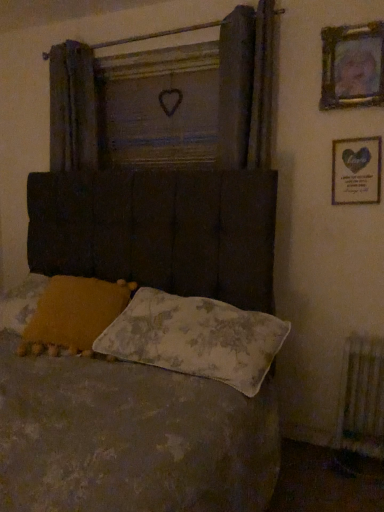
What is the approximate height of floral fabric pillow at center, the first pillow from the right?

11.17 inches.

Measure the distance between point (334, 186) and camera.

Point (334, 186) and camera are 2.04 meters apart from each other.

You are a GUI agent. You are given a task and a screenshot of the screen. Output one action in this format:
    pyautogui.click(x=<x>, y=<y>)
    Task: Click on the metallic silver frame at upper right, positioned as the 2th picture frame in top-to-bottom order
    
    Given the screenshot: What is the action you would take?
    pyautogui.click(x=356, y=170)

Identify the location of gold-framed picture at upper right, the second picture frame in the bottom-to-top sequence. The width and height of the screenshot is (384, 512). (352, 66).

The image size is (384, 512). What do you see at coordinates (74, 314) in the screenshot?
I see `fluffy yellow pillow at lower left, positioned as the 2th pillow in right-to-left order` at bounding box center [74, 314].

Measure the distance between point (101, 319) and camera.

A distance of 6.17 feet exists between point (101, 319) and camera.

What do you see at coordinates (73, 108) in the screenshot?
I see `dark gray fabric curtain at upper left` at bounding box center [73, 108].

The width and height of the screenshot is (384, 512). Identify the location of floral fabric pillow at center, the first pillow from the right. (195, 338).

I want to click on picture frame that is above the metallic silver frame at upper right, the 1th picture frame from the bottom (from the image's perspective), so click(352, 66).

From a real-world perspective, is metallic silver frame at upper right, positioned as the 2th picture frame in top-to-bottom order, located beneath gold-framed picture at upper right, the first picture frame positioned from the top?

Yes.

In the scene shown: Is metallic silver frame at upper right, the 1th picture frame from the bottom, wider or thinner than gold-framed picture at upper right, the second picture frame in the bottom-to-top sequence?

metallic silver frame at upper right, the 1th picture frame from the bottom, is thinner than gold-framed picture at upper right, the second picture frame in the bottom-to-top sequence.

Which object is closer to the camera, metallic silver frame at upper right, the 1th picture frame from the bottom, or gold-framed picture at upper right, the first picture frame positioned from the top?

gold-framed picture at upper right, the first picture frame positioned from the top, is more forward.

Which of these two, textured fabric bed at center or wooden heart at center, is bigger?

textured fabric bed at center.

Can we say textured fabric bed at center lies outside wooden heart at center?

Absolutely, textured fabric bed at center is external to wooden heart at center.

Are textured fabric bed at center and wooden heart at center making contact?

textured fabric bed at center is not next to wooden heart at center, and they're not touching.

From a real-world perspective, is textured fabric bed at center above or below gold-framed picture at upper right, the second picture frame in the bottom-to-top sequence?

From a real-world perspective, textured fabric bed at center is physically below gold-framed picture at upper right, the second picture frame in the bottom-to-top sequence.

Between textured fabric bed at center and gold-framed picture at upper right, the second picture frame in the bottom-to-top sequence, which one has more height?

With more height is textured fabric bed at center.

Between textured fabric bed at center and gold-framed picture at upper right, the first picture frame positioned from the top, which one has larger size?

Bigger between the two is textured fabric bed at center.

Is gold-framed picture at upper right, the first picture frame positioned from the top, inside textured fabric bed at center?

Actually, gold-framed picture at upper right, the first picture frame positioned from the top, is outside textured fabric bed at center.

Could metallic silver frame at upper right, the 1th picture frame from the bottom, be considered to be inside dark gray fabric curtain at upper left?

That's incorrect, metallic silver frame at upper right, the 1th picture frame from the bottom, is not inside dark gray fabric curtain at upper left.

Which object is wider, dark gray fabric curtain at upper left or metallic silver frame at upper right, the 1th picture frame from the bottom?

With larger width is dark gray fabric curtain at upper left.

Is dark gray fabric curtain at upper left bigger than metallic silver frame at upper right, positioned as the 2th picture frame in top-to-bottom order?

Yes.

From a real-world perspective, is fluffy yellow pillow at lower left, placed as the 1th pillow when sorted from left to right, over wooden heart at center?

Actually, fluffy yellow pillow at lower left, placed as the 1th pillow when sorted from left to right, is physically below wooden heart at center in the real world.

What's the angular difference between fluffy yellow pillow at lower left, placed as the 1th pillow when sorted from left to right, and wooden heart at center's facing directions?

16.5 degrees.

From the image's perspective, who appears lower, fluffy yellow pillow at lower left, placed as the 1th pillow when sorted from left to right, or wooden heart at center?

From the image's view, fluffy yellow pillow at lower left, placed as the 1th pillow when sorted from left to right, is below.

Is floral fabric pillow at center, the first pillow from the right, bigger than gold-framed picture at upper right, the first picture frame positioned from the top?

Indeed, floral fabric pillow at center, the first pillow from the right, has a larger size compared to gold-framed picture at upper right, the first picture frame positioned from the top.

Between floral fabric pillow at center, positioned as the 2th pillow in left-to-right order, and gold-framed picture at upper right, the second picture frame in the bottom-to-top sequence, which one has larger width?

floral fabric pillow at center, positioned as the 2th pillow in left-to-right order, is wider.

From the image's perspective, starting from the gold-framed picture at upper right, the first picture frame positioned from the top, which pillow is the 2nd one below? Please provide its 2D coordinates.

[(195, 338)]

Is floral fabric pillow at center, positioned as the 2th pillow in left-to-right order, positioned far away from gold-framed picture at upper right, the second picture frame in the bottom-to-top sequence?

floral fabric pillow at center, positioned as the 2th pillow in left-to-right order, is positioned a significant distance from gold-framed picture at upper right, the second picture frame in the bottom-to-top sequence.

Between point (367, 375) and point (147, 145), which one is positioned behind?

The point (147, 145) is farther from the camera.

Is white textured radiator at lower right looking in the opposite direction of wooden heart at center?

white textured radiator at lower right is not turned away from wooden heart at center.

Would you say white textured radiator at lower right is inside or outside wooden heart at center?

white textured radiator at lower right is not inside wooden heart at center, it's outside.

From a real-world perspective, is white textured radiator at lower right above or below wooden heart at center?

Clearly, from a real-world perspective, white textured radiator at lower right is below wooden heart at center.

Image resolution: width=384 pixels, height=512 pixels. In order to click on picture frame positioned vertically above the metallic silver frame at upper right, positioned as the 2th picture frame in top-to-bottom order (from a real-world perspective) in this screenshot , I will do `click(352, 66)`.

What are the coordinates of `window screen behind the textured fabric bed at center` in the screenshot? It's located at (159, 106).

Looking at the image, which one is located further to gold-framed picture at upper right, the first picture frame positioned from the top, textured fabric bed at center or fluffy yellow pillow at lower left, placed as the 1th pillow when sorted from left to right?

Based on the image, fluffy yellow pillow at lower left, placed as the 1th pillow when sorted from left to right, appears to be further to gold-framed picture at upper right, the first picture frame positioned from the top.

Looking at the image, which one is located closer to textured fabric bed at center, gold-framed picture at upper right, the first picture frame positioned from the top, or fluffy yellow pillow at lower left, positioned as the 2th pillow in right-to-left order?

The object closer to textured fabric bed at center is fluffy yellow pillow at lower left, positioned as the 2th pillow in right-to-left order.

Which object lies nearer to the anchor point wooden heart at center, gold-framed picture at upper right, the first picture frame positioned from the top, or metallic silver frame at upper right, positioned as the 2th picture frame in top-to-bottom order?

gold-framed picture at upper right, the first picture frame positioned from the top, is positioned closer to the anchor wooden heart at center.

Based on their spatial positions, is wooden heart at center or dark gray fabric curtain at upper left closer to gold-framed picture at upper right, the second picture frame in the bottom-to-top sequence?

The object closer to gold-framed picture at upper right, the second picture frame in the bottom-to-top sequence, is wooden heart at center.

Based on their spatial positions, is gold-framed picture at upper right, the first picture frame positioned from the top, or white textured radiator at lower right closer to metallic silver frame at upper right, the 1th picture frame from the bottom?

Based on the image, gold-framed picture at upper right, the first picture frame positioned from the top, appears to be nearer to metallic silver frame at upper right, the 1th picture frame from the bottom.

From the image, which object appears to be farther from gold-framed picture at upper right, the second picture frame in the bottom-to-top sequence, wooden heart at center or white textured radiator at lower right?

white textured radiator at lower right is further to gold-framed picture at upper right, the second picture frame in the bottom-to-top sequence.

Estimate the real-world distances between objects in this image. Which object is closer to textured fabric bed at center, floral fabric pillow at center, the first pillow from the right, or metallic silver frame at upper right, the 1th picture frame from the bottom?

Based on the image, floral fabric pillow at center, the first pillow from the right, appears to be nearer to textured fabric bed at center.

Looking at the image, which one is located closer to floral fabric pillow at center, positioned as the 2th pillow in left-to-right order, white textured radiator at lower right or textured fabric bed at center?

textured fabric bed at center lies closer to floral fabric pillow at center, positioned as the 2th pillow in left-to-right order, than the other object.

Identify the location of radiator positioned between textured fabric bed at center and metallic silver frame at upper right, positioned as the 2th picture frame in top-to-bottom order, from near to far. The height and width of the screenshot is (512, 384). (362, 397).

Where is `picture frame between fluffy yellow pillow at lower left, positioned as the 2th pillow in right-to-left order, and metallic silver frame at upper right, positioned as the 2th picture frame in top-to-bottom order`? This screenshot has height=512, width=384. picture frame between fluffy yellow pillow at lower left, positioned as the 2th pillow in right-to-left order, and metallic silver frame at upper right, positioned as the 2th picture frame in top-to-bottom order is located at coordinates (352, 66).

Locate an element on the screen. This screenshot has width=384, height=512. picture frame between wooden heart at center and floral fabric pillow at center, positioned as the 2th pillow in left-to-right order, in the vertical direction is located at coordinates (356, 170).

You are a GUI agent. You are given a task and a screenshot of the screen. Output one action in this format:
    pyautogui.click(x=<x>, y=<y>)
    Task: Click on the pillow between fluffy yellow pillow at lower left, placed as the 1th pillow when sorted from left to right, and white textured radiator at lower right
    
    Given the screenshot: What is the action you would take?
    pyautogui.click(x=195, y=338)